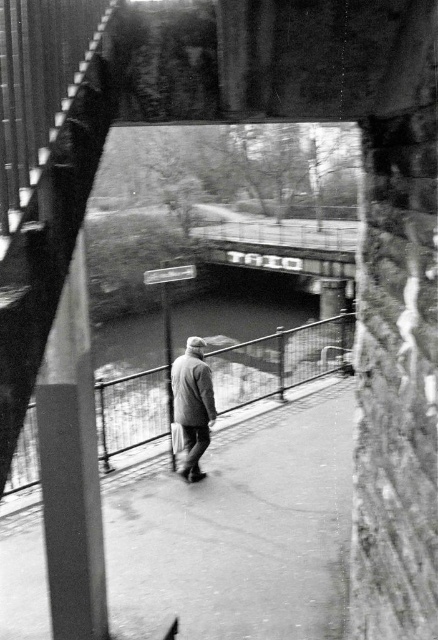
You are standing on a bridge and want to place a 6 feet long ladder horizontally on the ground next to the smooth metal rail at center. Can you fit the ladder there?

The distance between the smooth metal rail at center and the viewer is 6.52 feet. Since the ladder is 6 feet long, it can be placed horizontally next to the smooth metal rail at center as there is enough space.

You are standing on the bridge and see the smooth metal rail at center and the gray woolen jacket at center. Which object is bigger?

The smooth metal rail at center is larger in size compared to the gray woolen jacket at center.